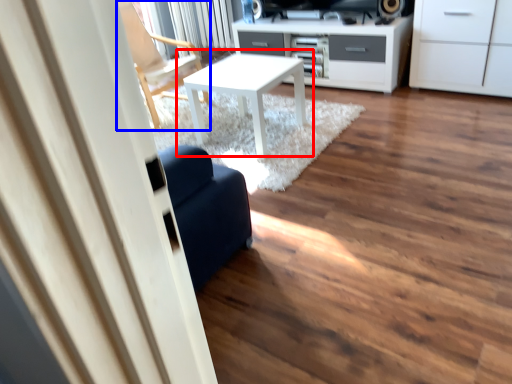
Question: Which object appears farthest to the camera in this image, table (highlighted by a red box) or chair (highlighted by a blue box)?

Choices:
 (A) table
 (B) chair

Answer: (B)